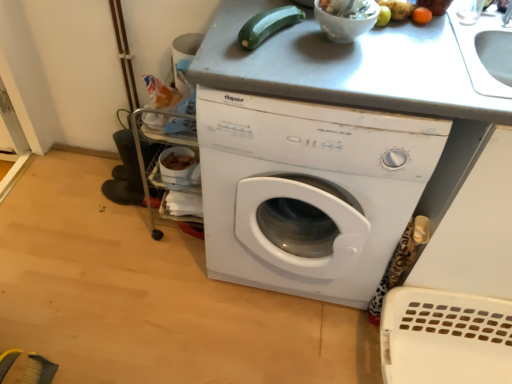
Identify the location of free location to the right of white glossy bowl at upper center. This screenshot has height=384, width=512. tap(413, 48).